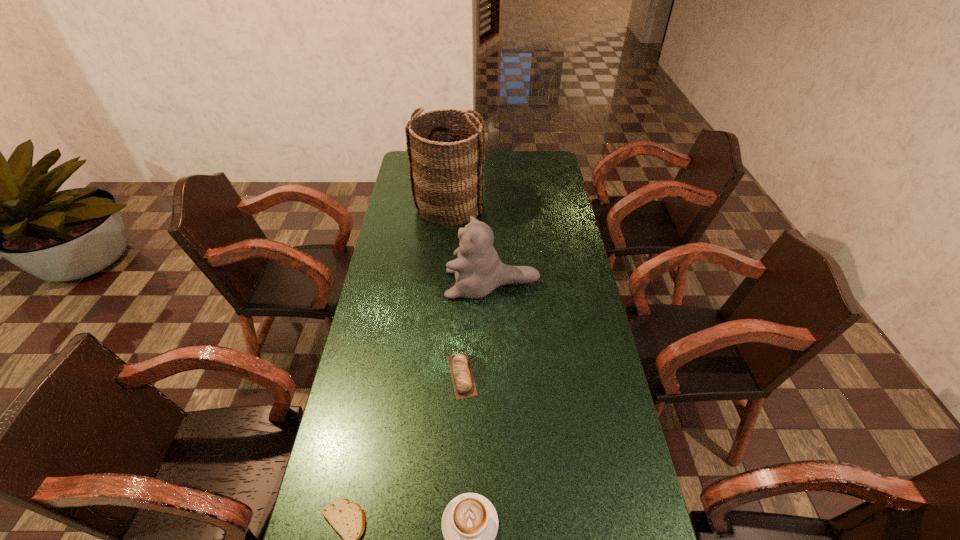
I want to click on blank space located on the right of the taller pita bread, so click(504, 375).

Where is `object at the left edge`? object at the left edge is located at coordinates (446, 157).

Locate an element on the screen. free spot at the far edge of the desktop is located at coordinates (511, 174).

This screenshot has width=960, height=540. I want to click on vacant space at the left edge of the desktop, so click(x=329, y=482).

In order to click on vacant region at the right edge of the desktop in this screenshot , I will do `click(585, 298)`.

Image resolution: width=960 pixels, height=540 pixels. I want to click on free space between the farther pita bread and the second farthest object, so click(x=477, y=330).

Identify which object is the nearest to the farthest object. Please provide its 2D coordinates. Your answer should be formatted as a tuple, i.e. [(x, y)], where the tuple contains the x and y coordinates of a point satisfying the conditions above.

[(478, 270)]

Where is `object that ranks as the closest to the farther pita bread`? object that ranks as the closest to the farther pita bread is located at coordinates (478, 270).

Where is `vacant space that satisfies the following two spatial constraints: 1. on the front side of the tallest object; 2. on the left side of the fourth tallest object`? The height and width of the screenshot is (540, 960). vacant space that satisfies the following two spatial constraints: 1. on the front side of the tallest object; 2. on the left side of the fourth tallest object is located at coordinates (436, 375).

This screenshot has height=540, width=960. Find the location of `free space that satisfies the following two spatial constraints: 1. on the face of the second tallest object; 2. on the front side of the right pita bread`. free space that satisfies the following two spatial constraints: 1. on the face of the second tallest object; 2. on the front side of the right pita bread is located at coordinates (494, 375).